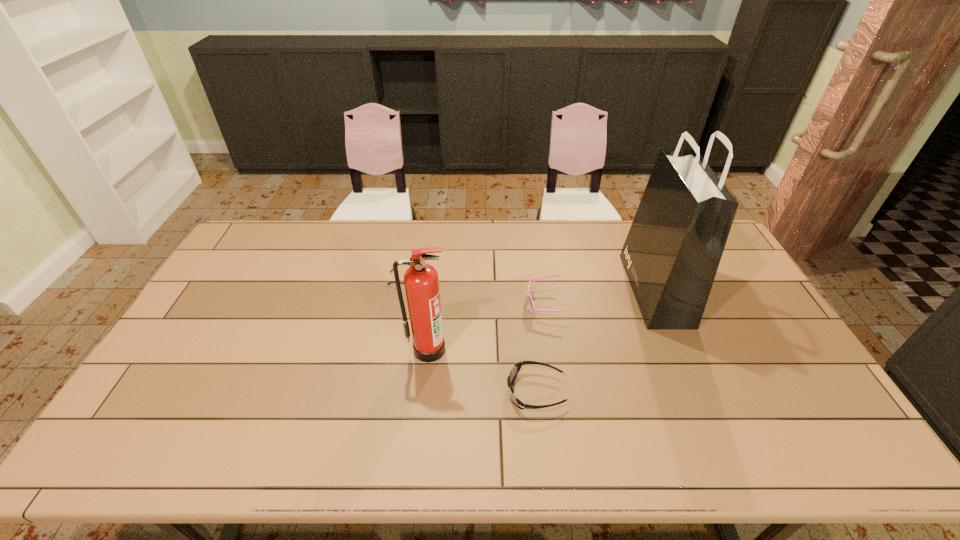
Image resolution: width=960 pixels, height=540 pixels. Find the location of `free space between the shortest sunglasses and the nearest sunglasses`. free space between the shortest sunglasses and the nearest sunglasses is located at coordinates (470, 335).

You are a GUI agent. You are given a task and a screenshot of the screen. Output one action in this format:
    pyautogui.click(x=<x>, y=<y>)
    Task: Click on the object that is the closest to the shortest object
    
    Given the screenshot: What is the action you would take?
    pyautogui.click(x=421, y=280)

You are a GUI agent. You are given a task and a screenshot of the screen. Output one action in this format:
    pyautogui.click(x=<x>, y=<y>)
    Task: Click on the second closest object to the second nearest object
    
    Given the screenshot: What is the action you would take?
    pyautogui.click(x=398, y=265)

Locate which sunglasses ranks second in proximity to the third tallest object. Please provide its 2D coordinates. Your answer should be formatted as a tuple, i.e. [(x, y)], where the tuple contains the x and y coordinates of a point satisfying the conditions above.

[(398, 265)]

Identify the location of sunglasses that stands as the closest to the shortest sunglasses. (531, 304).

Identify the location of blank area in the image that satisfies the following two spatial constraints: 1. on the front-facing side of the tallest sunglasses; 2. with the nozzle pointing from the back of the second nearest object. The width and height of the screenshot is (960, 540). (550, 349).

At what (x,y) coordinates should I click in order to perform the action: click on vacant space that satisfies the following two spatial constraints: 1. on the front with handles of the tallest object; 2. with the nozzle pointing from the back of the fourth shortest object. Please return your answer as a coordinate pair (x, y). The width and height of the screenshot is (960, 540). Looking at the image, I should click on (681, 349).

Identify the location of vacant position in the image that satisfies the following two spatial constraints: 1. on the front-facing side of the tallest sunglasses; 2. with the nozzle pointing from the back of the fire extinguisher. The width and height of the screenshot is (960, 540). (550, 349).